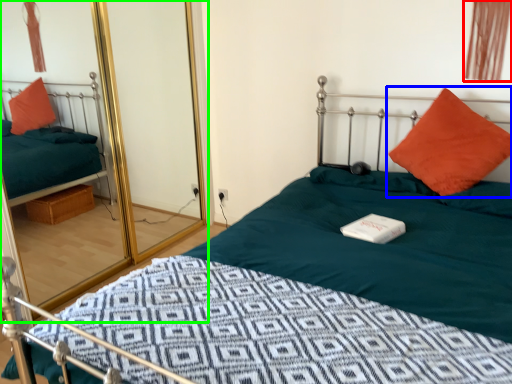
Question: Based on their relative distances, which object is farther from curtain (highlighted by a red box)? Choose from pillow (highlighted by a blue box) and glass door (highlighted by a green box).

Choices:
 (A) pillow
 (B) glass door

Answer: (B)